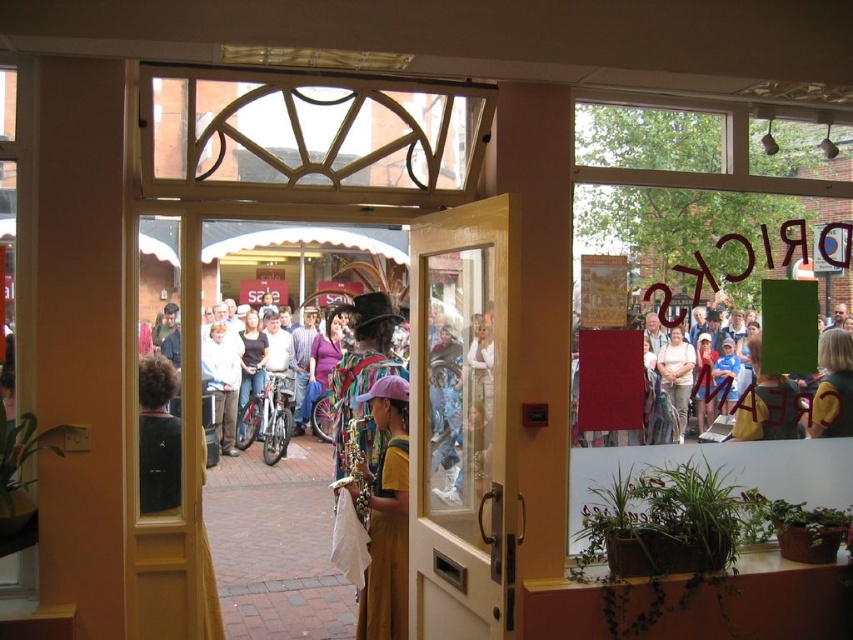
Question: Is golden yellow dress at center thinner than denim jeans at center?

Choices:
 (A) yes
 (B) no

Answer: (A)

Question: Which is farther from the white painted wood door at center?

Choices:
 (A) dark brown leather jacket at center
 (B) striped fabric dress at center
 (C) matte yellow dress at center
 (D) matte black dress at center

Answer: (B)

Question: Which of the following is the closest to the observer?

Choices:
 (A) (277, 344)
 (B) (672, 384)
 (C) (828, 356)
 (D) (476, 282)

Answer: (D)

Question: Which object is farther from the camera taking this photo?

Choices:
 (A) golden yellow dress at center
 (B) dark brown leather jacket at center

Answer: (A)

Question: Is the position of denim jeans at center less distant than that of denim jacket at center?

Choices:
 (A) no
 (B) yes

Answer: (B)

Question: Is denim jeans at center in front of matte black dress at center?

Choices:
 (A) no
 (B) yes

Answer: (A)